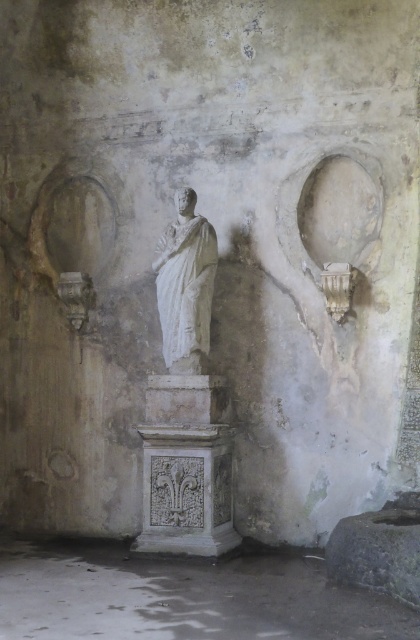
You are an archaeologist examining the ancient structure. You notice the white marble pedestal at center and the white marble statue at center. Which object is located to the right of the other?

The white marble pedestal at center is positioned on the right side of the white marble statue at center.

You are an archaeologist examining the ancient structure. You need to determine if the white marble statue at center can be moved to a storage area that can only accommodate items up to the width of the white marble pedestal at center. Can the statue fit based on their widths?

The white marble pedestal at center is wider than the white marble statue at center. Since the storage area can accommodate items up to the pedestal width, the statue can fit as its width is narrower than the pedestal.